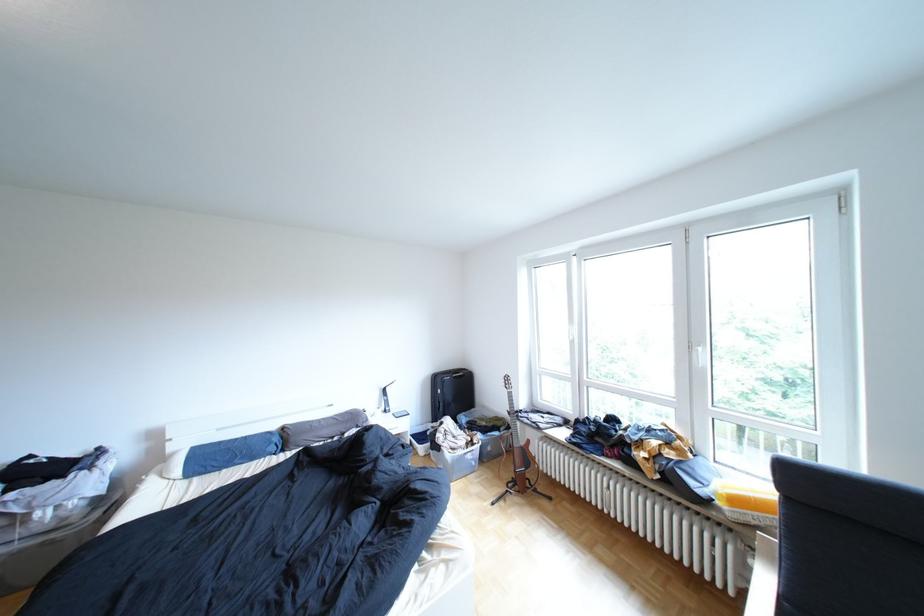
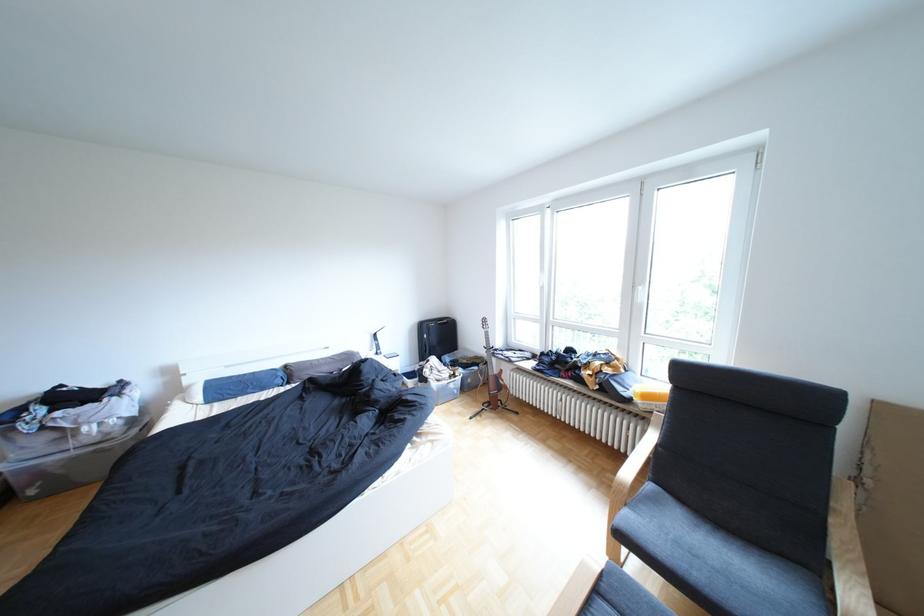
Question: Which direction would the cameraman need to move to produce the second image? Reply with the corresponding letter.

Choices:
 (A) Left
 (B) Right
 (C) Forward
 (D) Backward

Answer: (D)